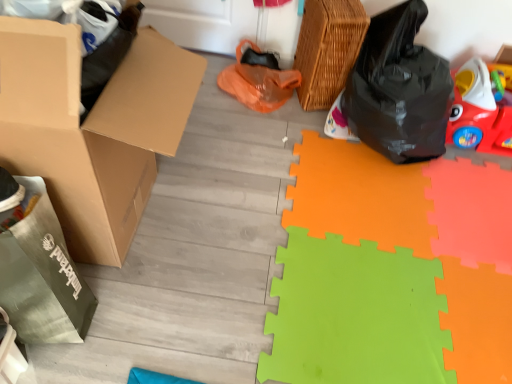
Identify the location of vacant space underneath green foam mat at lower right (from a real-world perspective). The image size is (512, 384). (431, 284).